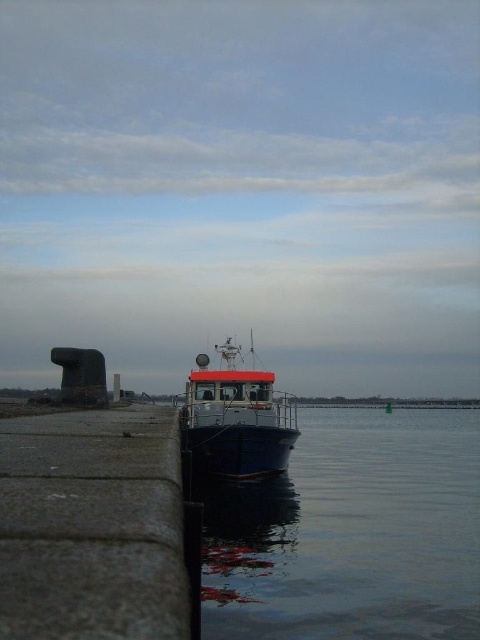
Is smooth blue water at center above granite-like ledge at lower left?

Incorrect, smooth blue water at center is not positioned above granite-like ledge at lower left.

Does smooth blue water at center have a larger size compared to granite-like ledge at lower left?

Correct, smooth blue water at center is larger in size than granite-like ledge at lower left.

Measure the distance between point (205, 586) and camera.

They are 10.04 meters apart.

The width and height of the screenshot is (480, 640). What are the coordinates of `smooth blue water at center` in the screenshot? It's located at (351, 532).

Who is higher up, granite-like ledge at lower left or blue metallic boat at center?

granite-like ledge at lower left

Between point (140, 596) and point (180, 426), which one is positioned in front?

Point (140, 596)

Find the location of a particular element. granite-like ledge at lower left is located at coordinates (92, 525).

Between point (408, 600) and point (204, 358), which one is positioned behind?

The point (204, 358) is more distant.

From the picture: Does smooth blue water at center appear under blue metallic boat at center?

Indeed, smooth blue water at center is positioned under blue metallic boat at center.

Find the location of `smooth blue water at center`. smooth blue water at center is located at coordinates (351, 532).

Identify the location of smooth blue water at center. (351, 532).